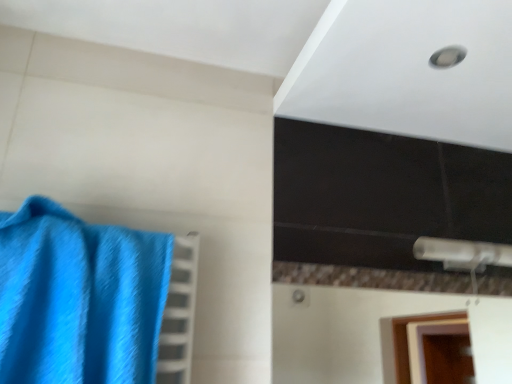
The image size is (512, 384). I want to click on blue fabric at left, so click(x=79, y=298).

Describe the element at coordinates (79, 298) in the screenshot. I see `blue fabric at left` at that location.

What is the approximate height of blue fabric at left?

blue fabric at left is 13.94 inches tall.

Identify the location of blue fabric at left. (79, 298).